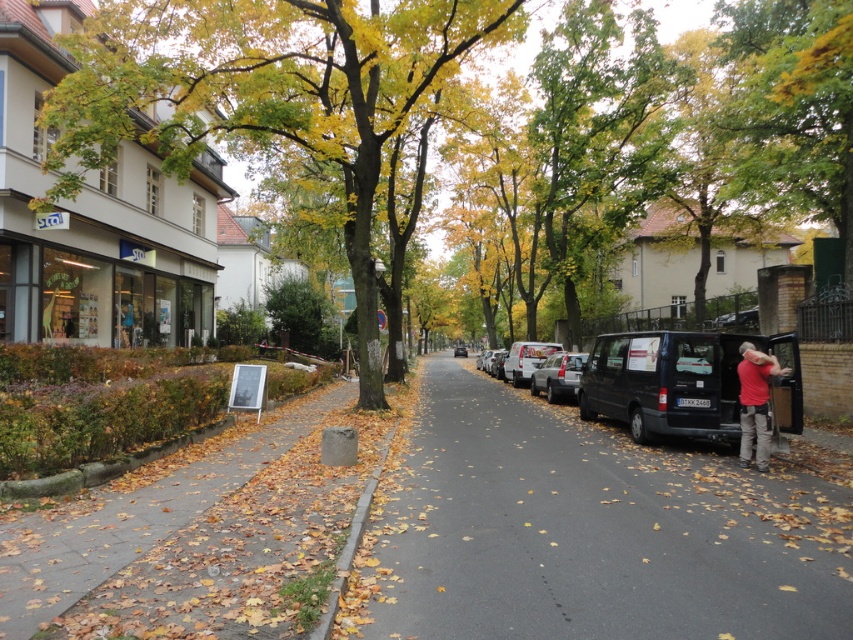
Question: Among these points, which one is farthest from the camera?

Choices:
 (A) (601, 348)
 (B) (572, 358)
 (C) (764, 422)

Answer: (B)

Question: Can you confirm if smooth asphalt road at center is positioned to the left of green leafy tree at left?

Choices:
 (A) no
 (B) yes

Answer: (A)

Question: Where is white matte van at center located in relation to shiny black van at center in the image?

Choices:
 (A) below
 (B) above

Answer: (B)

Question: Which object appears closest to the camera in this image?

Choices:
 (A) satin silver car at center
 (B) black matte van at right
 (C) shiny black van at center
 (D) smooth asphalt road at center

Answer: (D)

Question: Is black matte van at right positioned before satin silver car at center?

Choices:
 (A) no
 (B) yes

Answer: (B)

Question: Among these objects, which one is nearest to the camera?

Choices:
 (A) smooth asphalt road at center
 (B) satin silver car at center

Answer: (A)